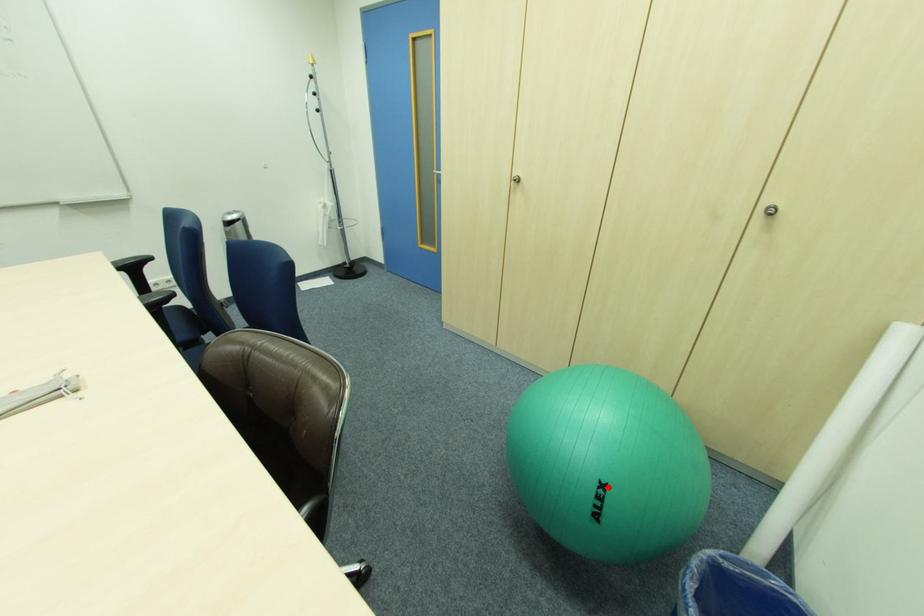
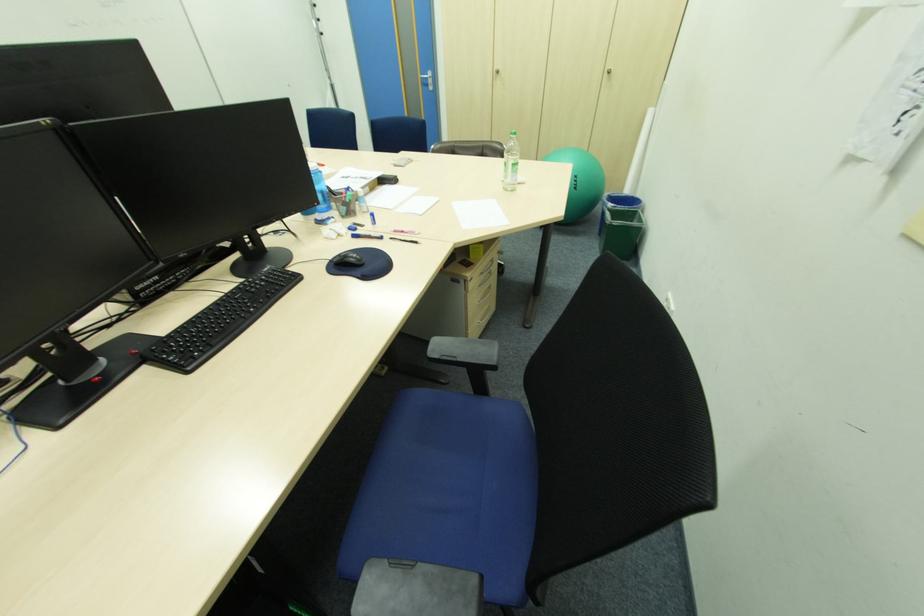
Where in the second image is the point corresponding to the highlighted location from the first image?

(581, 177)